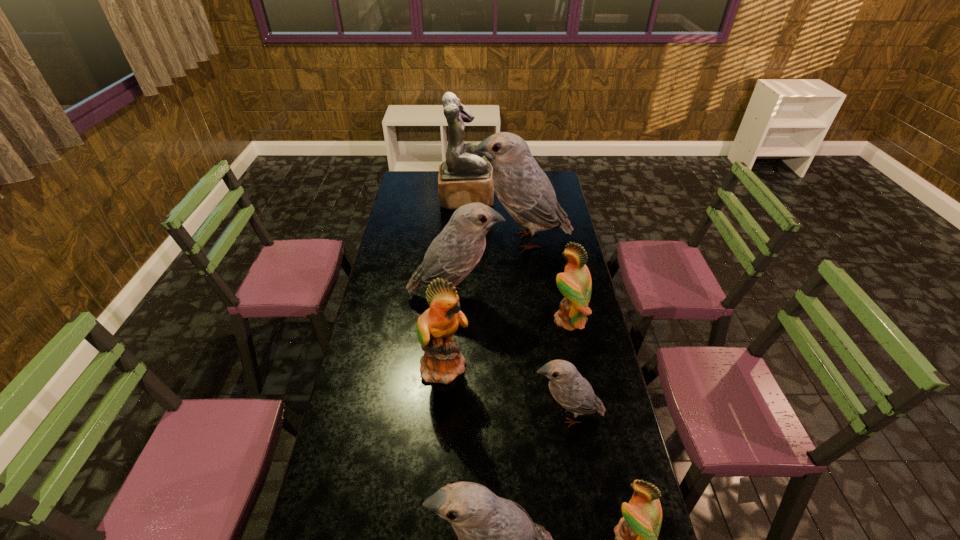
Identify which object is located as the seventh nearest to the tallest parrot. Please provide its 2D coordinates. Your answer should be formatted as a tuple, i.e. [(x, y)], where the tuple contains the x and y coordinates of a point satisfying the conditions above.

[(497, 538)]

This screenshot has height=540, width=960. Find the location of `object that is the closest to the second farthest gray parrot`. object that is the closest to the second farthest gray parrot is located at coordinates (442, 362).

Locate an element on the screen. Image resolution: width=960 pixels, height=540 pixels. parrot that is the closest one to the nearest gray parrot is located at coordinates (636, 534).

This screenshot has width=960, height=540. Identify the location of the fifth closest parrot to the second farthest green parrot. (525, 191).

I want to click on gray parrot that stands as the second closest to the smallest green parrot, so click(x=572, y=391).

Where is `gray parrot that is the closest one to the third nearest object`? gray parrot that is the closest one to the third nearest object is located at coordinates (497, 538).

Locate an element on the screen. The height and width of the screenshot is (540, 960). green parrot object that ranks as the third closest to the second biggest gray parrot is located at coordinates (636, 534).

Locate which green parrot is the third closest to the smallest gray parrot. Please provide its 2D coordinates. Your answer should be formatted as a tuple, i.e. [(x, y)], where the tuple contains the x and y coordinates of a point satisfying the conditions above.

[(575, 284)]